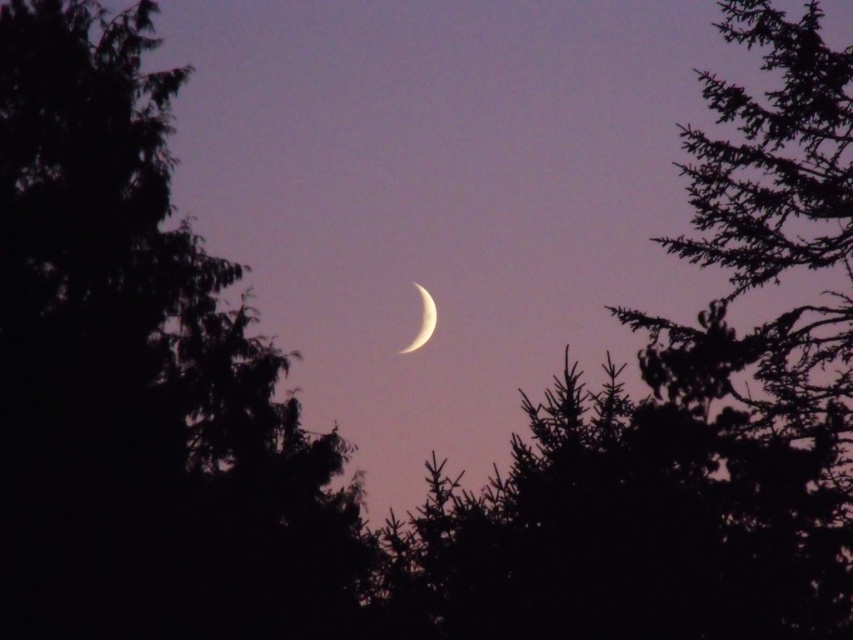
Based on the photo, does dark green leafy tree at center have a greater height compared to green leafy tree at center?

No.

Consider the image. Who is more forward, (20, 118) or (631, 502)?

Positioned in front is point (631, 502).

At what (x,y) coordinates should I click in order to perform the action: click on dark green leafy tree at center. Please return your answer as a coordinate pair (x, y). This screenshot has width=853, height=640. Looking at the image, I should click on (140, 378).

Is green leafy tree at center below white glossy crescent moon at center?

No.

Can you confirm if green leafy tree at center is taller than white glossy crescent moon at center?

Correct, green leafy tree at center is much taller as white glossy crescent moon at center.

Is point (676, 472) more distant than point (422, 289)?

No, it is in front of (422, 289).

Image resolution: width=853 pixels, height=640 pixels. Identify the location of green leafy tree at center. (679, 420).

Can you confirm if dark green leafy tree at center is thinner than white glossy crescent moon at center?

In fact, dark green leafy tree at center might be wider than white glossy crescent moon at center.

Is point (271, 442) less distant than point (410, 340)?

Yes.

At what (x,y) coordinates should I click in order to perform the action: click on dark green leafy tree at center. Please return your answer as a coordinate pair (x, y). This screenshot has width=853, height=640. Looking at the image, I should click on (140, 378).